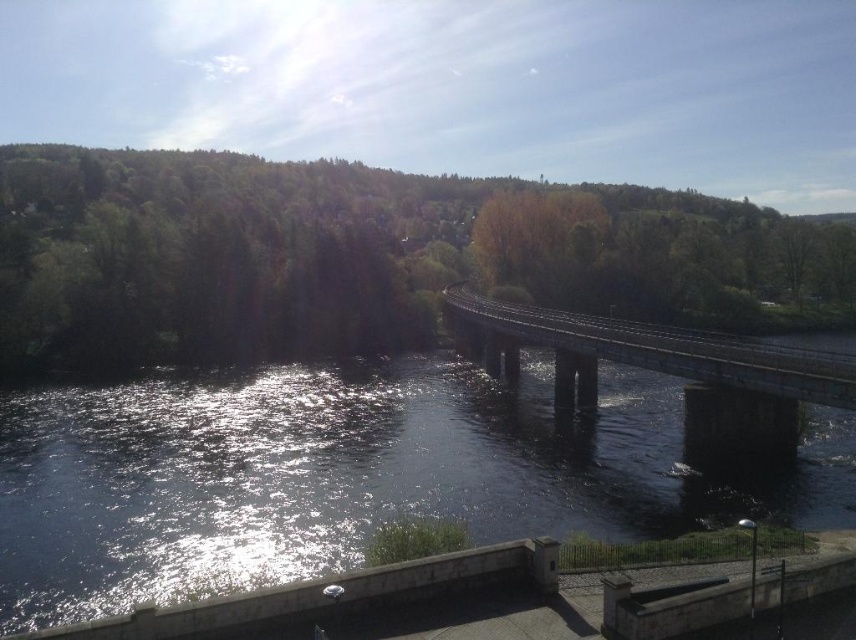
Identify the location of dark blue water at center. The height and width of the screenshot is (640, 856). (348, 474).

Who is higher up, dark blue water at center or dark gray concrete bridge at center?

dark gray concrete bridge at center is higher up.

Between point (284, 579) and point (508, 336), which one is positioned behind?

The point (508, 336) is more distant.

The width and height of the screenshot is (856, 640). What are the coordinates of `dark blue water at center` in the screenshot? It's located at (348, 474).